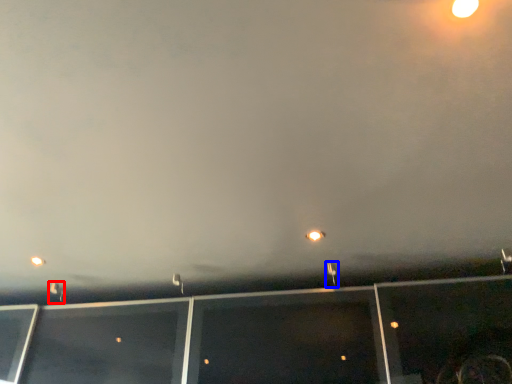
Question: Which of the following is the closest to the observer, street light (highlighted by a red box) or street light (highlighted by a blue box)?

Choices:
 (A) street light
 (B) street light

Answer: (B)